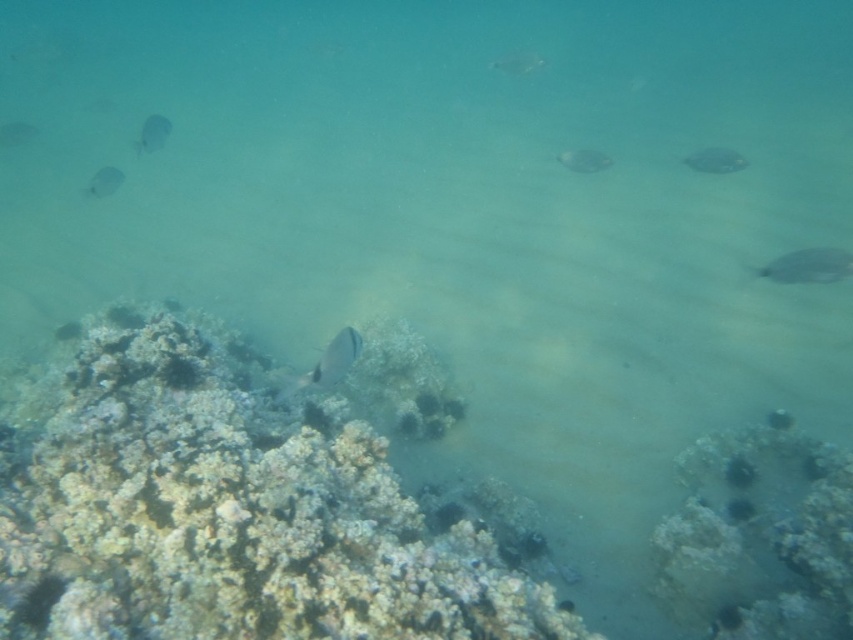
Is smooth silver fish at right bigger than translucent white fish at upper left?

No, smooth silver fish at right is not bigger than translucent white fish at upper left.

Where is `smooth silver fish at right`? smooth silver fish at right is located at coordinates (715, 161).

Who is more forward, (x=734, y=164) or (x=144, y=148)?

Point (x=734, y=164) is in front.

Identify the location of smooth silver fish at right. The width and height of the screenshot is (853, 640). (715, 161).

Is white coral reef at center below smooth silver fish at right?

Yes, white coral reef at center is below smooth silver fish at right.

Can you confirm if white coral reef at center is wider than smooth silver fish at right?

Yes.

Is point (280, 627) in front of point (698, 157)?

Yes, point (280, 627) is in front of point (698, 157).

Identify the location of white coral reef at center. Image resolution: width=853 pixels, height=640 pixels. (225, 512).

Is shiny silver fish at right below translucent blue fish at upper left?

Correct, shiny silver fish at right is located below translucent blue fish at upper left.

Is shiny silver fish at right to the right of translucent blue fish at upper left from the viewer's perspective?

Yes, shiny silver fish at right is to the right of translucent blue fish at upper left.

Identify the location of shiny silver fish at right. (808, 266).